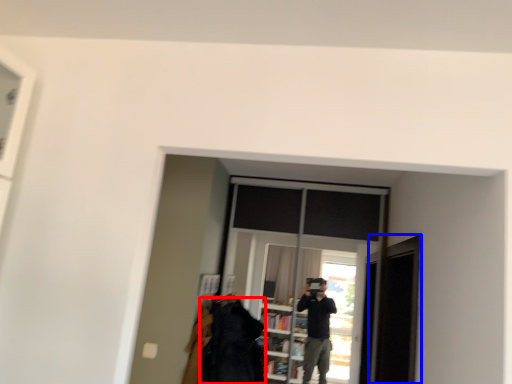
Question: Which object appears farthest to the camera in this image, clothing (highlighted by a red box) or screen door (highlighted by a blue box)?

Choices:
 (A) clothing
 (B) screen door

Answer: (A)